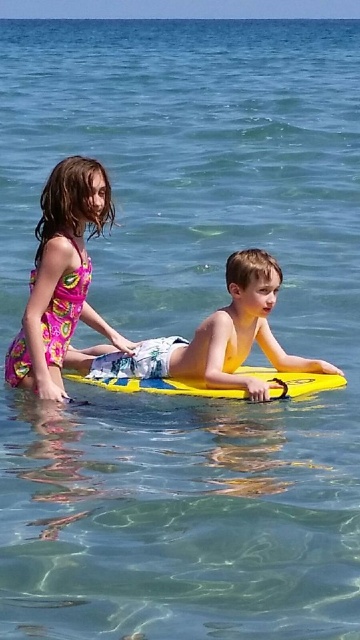
You are a photographer trying to capture a photo of the floral dress at left and the yellow foam surfboard at center. If you want to ensure both objects are in focus, which one should you adjust your camera focus on first based on their sizes?

The floral dress at left is larger than the yellow foam surfboard at center, so you should focus on the floral dress at left first to ensure both are in focus.

You are a photographer trying to capture the perfect shot of the yellow foam board at center. Based on the scene description, where should you position your camera to ensure the board is centered in the frame?

To center the yellow foam board at center in the frame, position your camera so that the board aligns with the point at coordinates 0.541 on the x axis and 0.589 on the y axis.